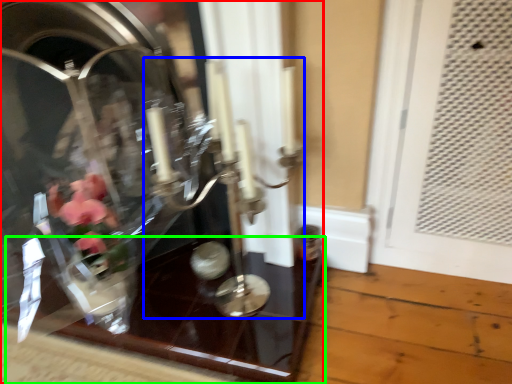
Question: Estimate the real-world distances between objects in this image. Which object is farther from glass box (highlighted by a red box), candle holder (highlighted by a blue box) or glass table (highlighted by a green box)?

Choices:
 (A) candle holder
 (B) glass table

Answer: (A)